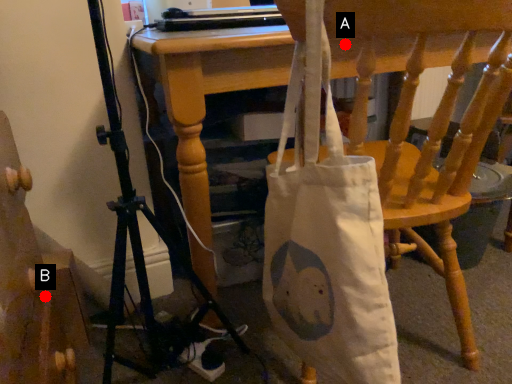
Question: Two points are circled on the image, labeled by A and B beside each circle. Which point is farther from the camera taking this photo?

Choices:
 (A) A is further
 (B) B is further

Answer: (A)